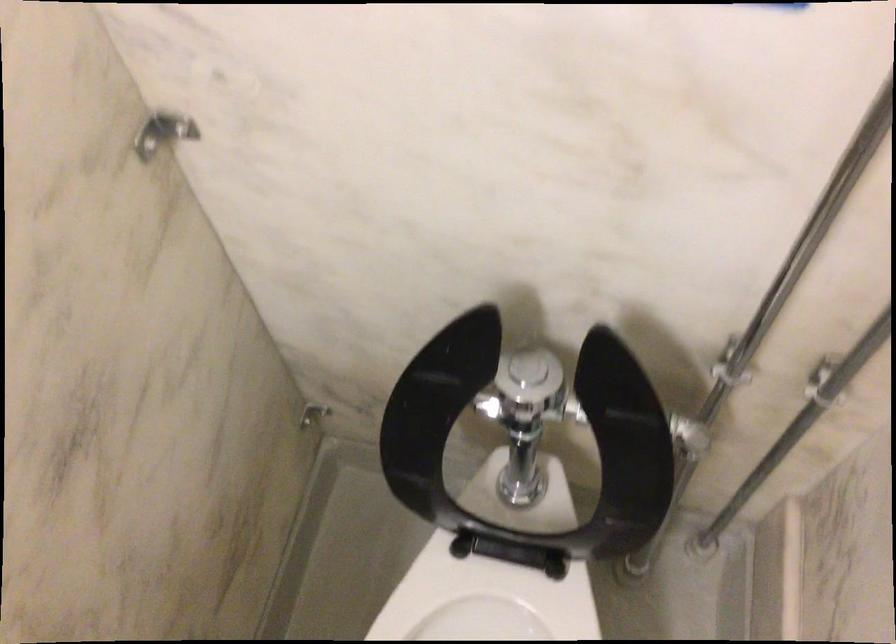
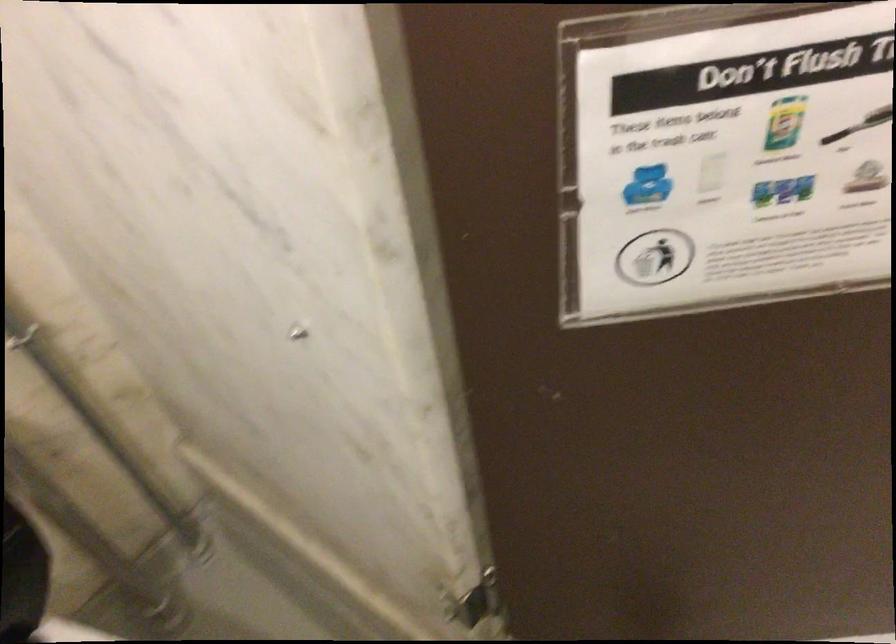
Question: How did the camera likely rotate?

Choices:
 (A) Left
 (B) Right
 (C) Up
 (D) Down

Answer: (B)